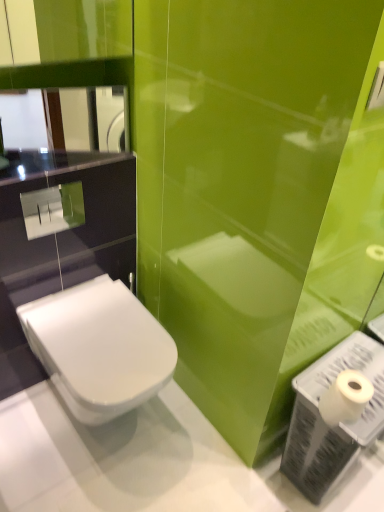
Question: Do you think glossy glass mirror at upper left is within white matte toilet paper at lower right, or outside of it?

Choices:
 (A) inside
 (B) outside

Answer: (B)

Question: From the image's perspective, is glossy glass mirror at upper left positioned above or below white matte toilet paper at lower right?

Choices:
 (A) below
 (B) above

Answer: (B)

Question: Based on their relative distances, which object is nearer to the glossy glass mirror at upper left?

Choices:
 (A) white matte toilet paper at lower right
 (B) white plastic toilet paper at lower right
 (C) white glossy toilet at lower left

Answer: (C)

Question: Based on their relative distances, which object is farther from the white matte toilet paper at lower right?

Choices:
 (A) glossy glass mirror at upper left
 (B) white plastic toilet paper at lower right
 (C) white glossy toilet at lower left

Answer: (A)